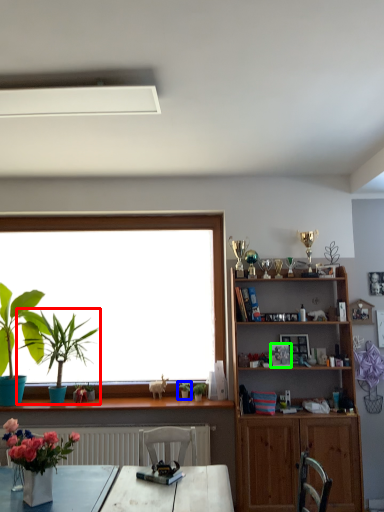
Question: Considering the real-world distances, which object is farthest from houseplant (highlighted by a red box)? houseplant (highlighted by a blue box) or picture frame (highlighted by a green box)?

Choices:
 (A) houseplant
 (B) picture frame

Answer: (B)